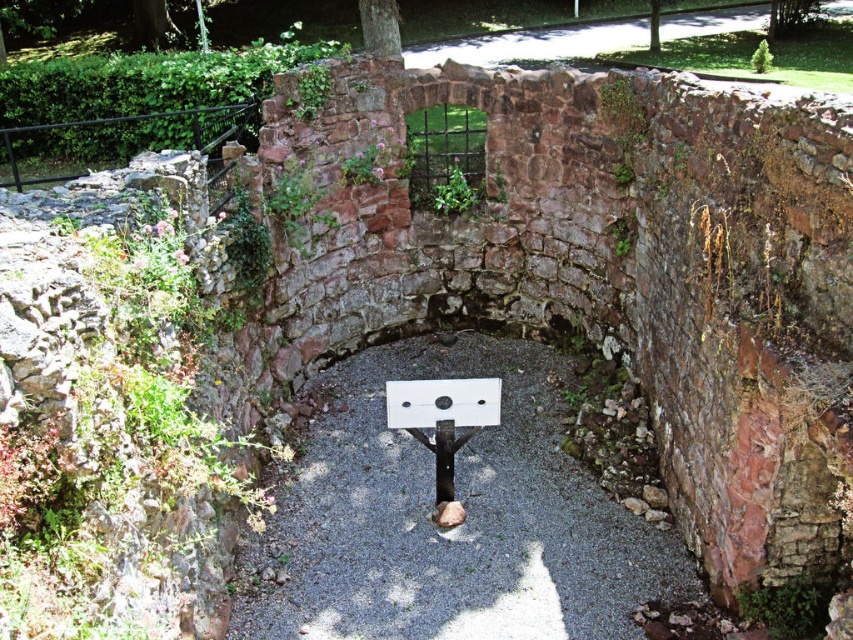
You are standing at the entrance of the arched stone structure and want to place a small decorative rock exactly at the center of the gray gravel at center. According to the coordinates provided, where should you place the rock?

You should place the small decorative rock at the coordinates point (451, 528) as that is the location of the gray gravel at center.

From the picture: You are standing in front of the arched stone structure and notice the gray gravel at center and the white plastic sign at center. Which object is positioned lower in relation to the other?

The gray gravel at center is located below the white plastic sign at center, so the gray gravel at center is positioned lower than the white plastic sign at center.

You are a tourist standing in front of the arched stone structure. You see the gray gravel at center and the white matte signpost at center. Which object is located to the right of the other?

The gray gravel at center is positioned on the right side of white matte signpost at center, so the gray gravel at center is to the right of the white matte signpost at center.